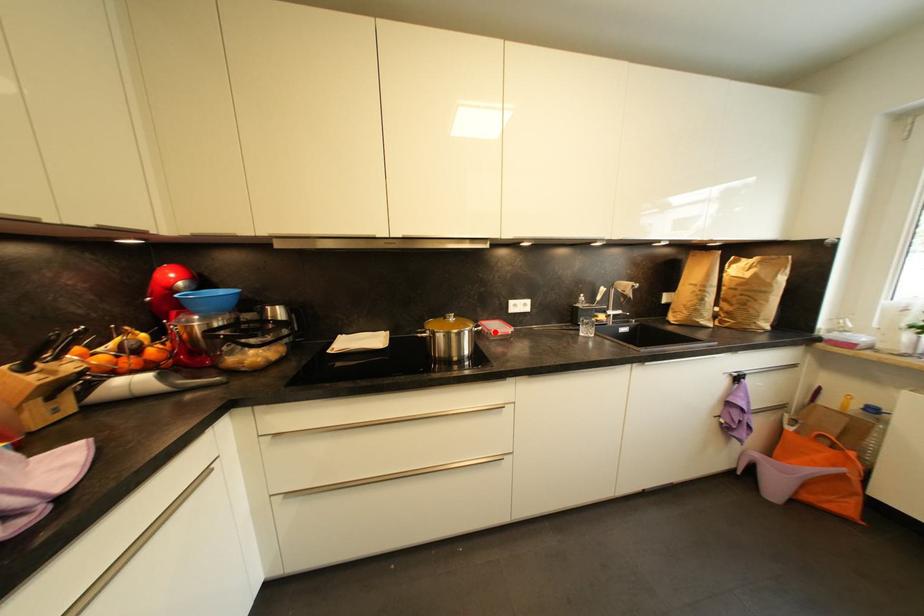
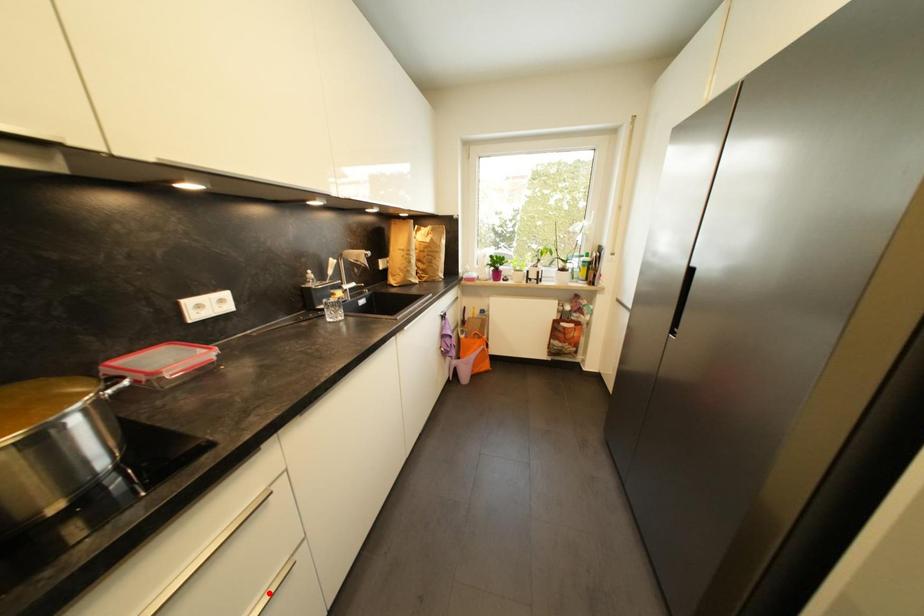
I am providing you with two images of the same scene from different viewpoints. A red point is marked on the first image and another point is marked on the second image. Are the points marked in image1 and image2 representing the same 3D position?

No